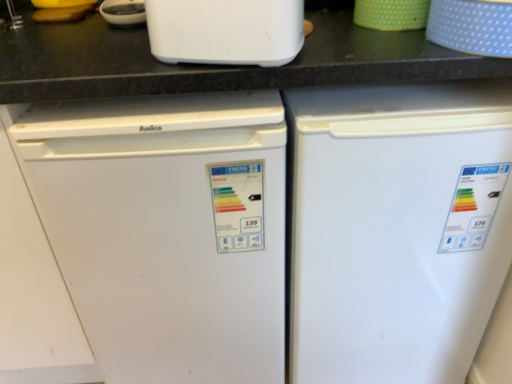
Question: Is white matte refrigerator at left, the first refrigerator from the left, smaller than green dotted cup at upper right, the second appliance positioned from the right?

Choices:
 (A) no
 (B) yes

Answer: (A)

Question: Considering the relative sizes of white matte refrigerator at left, the first refrigerator from the left, and green dotted cup at upper right, the second appliance positioned from the right, in the image provided, is white matte refrigerator at left, the first refrigerator from the left, thinner than green dotted cup at upper right, the second appliance positioned from the right,?

Choices:
 (A) yes
 (B) no

Answer: (B)

Question: From the image's perspective, is white matte refrigerator at left, the first refrigerator from the left, located above green dotted cup at upper right, which appears as the 1th appliance when viewed from the left?

Choices:
 (A) yes
 (B) no

Answer: (B)

Question: Can we say white matte refrigerator at left, the first refrigerator from the left, lies outside green dotted cup at upper right, the second appliance positioned from the right?

Choices:
 (A) yes
 (B) no

Answer: (A)

Question: Is the position of white matte refrigerator at left, the first refrigerator from the left, more distant than that of green dotted cup at upper right, which appears as the 1th appliance when viewed from the left?

Choices:
 (A) no
 (B) yes

Answer: (A)

Question: Would you say green dotted cup at upper right, the second appliance positioned from the right, is part of white matte refrigerator at left, the first refrigerator from the left,'s contents?

Choices:
 (A) yes
 (B) no

Answer: (B)

Question: Is blue dotted fabric at upper right, which ranks as the second appliance in left-to-right order, looking in the opposite direction of white matte refrigerator at center, which appears as the second refrigerator when viewed from the left?

Choices:
 (A) no
 (B) yes

Answer: (A)

Question: Considering the relative sizes of blue dotted fabric at upper right, which ranks as the second appliance in left-to-right order, and white matte refrigerator at center, which is the 1th refrigerator in right-to-left order, in the image provided, is blue dotted fabric at upper right, which ranks as the second appliance in left-to-right order, wider than white matte refrigerator at center, which is the 1th refrigerator in right-to-left order,?

Choices:
 (A) yes
 (B) no

Answer: (B)

Question: Is blue dotted fabric at upper right, the first appliance viewed from the right, not near white matte refrigerator at center, which appears as the second refrigerator when viewed from the left?

Choices:
 (A) no
 (B) yes

Answer: (A)

Question: From the image's perspective, is blue dotted fabric at upper right, which ranks as the second appliance in left-to-right order, beneath white matte refrigerator at center, which is the 1th refrigerator in right-to-left order?

Choices:
 (A) yes
 (B) no

Answer: (B)

Question: Does blue dotted fabric at upper right, the first appliance viewed from the right, have a lesser width compared to white matte refrigerator at center, which is the 1th refrigerator in right-to-left order?

Choices:
 (A) no
 (B) yes

Answer: (B)

Question: Could you tell me if blue dotted fabric at upper right, which ranks as the second appliance in left-to-right order, is facing white matte refrigerator at center, which is the 1th refrigerator in right-to-left order?

Choices:
 (A) no
 (B) yes

Answer: (A)

Question: From the image's perspective, does green dotted cup at upper right, the second appliance positioned from the right, appear lower than blue dotted fabric at upper right, the first appliance viewed from the right?

Choices:
 (A) no
 (B) yes

Answer: (A)